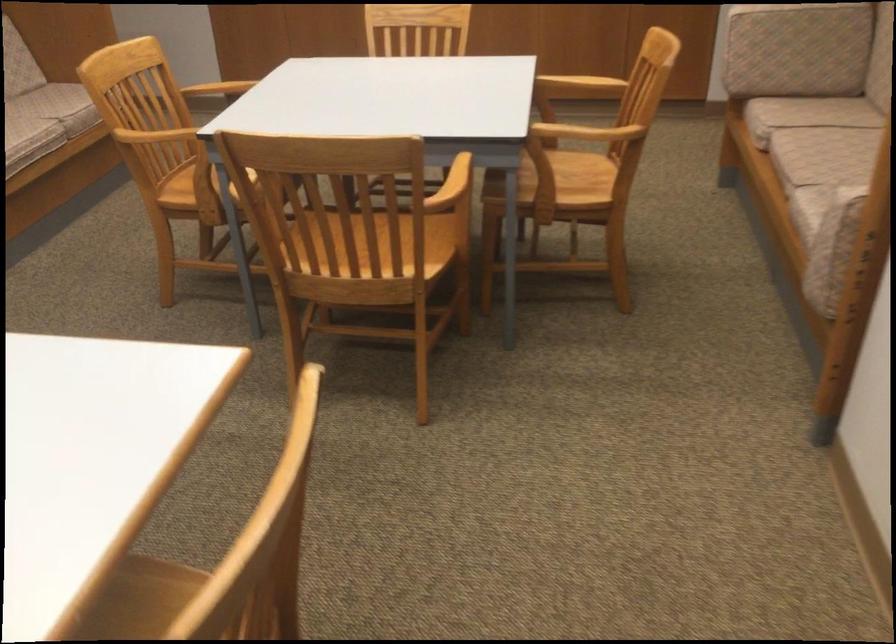
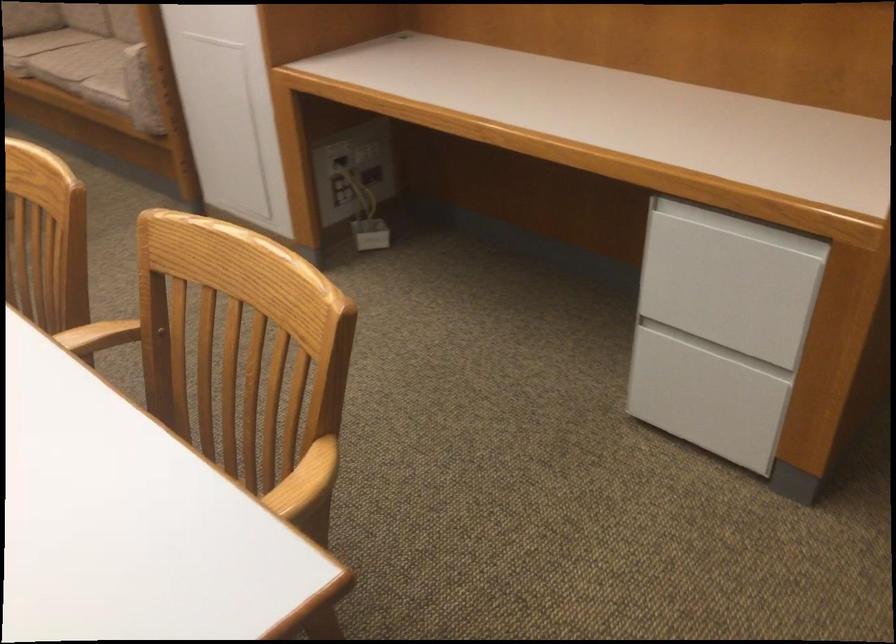
Where in the second image is the point corresponding to pixel 806 152 from the first image?

(76, 61)